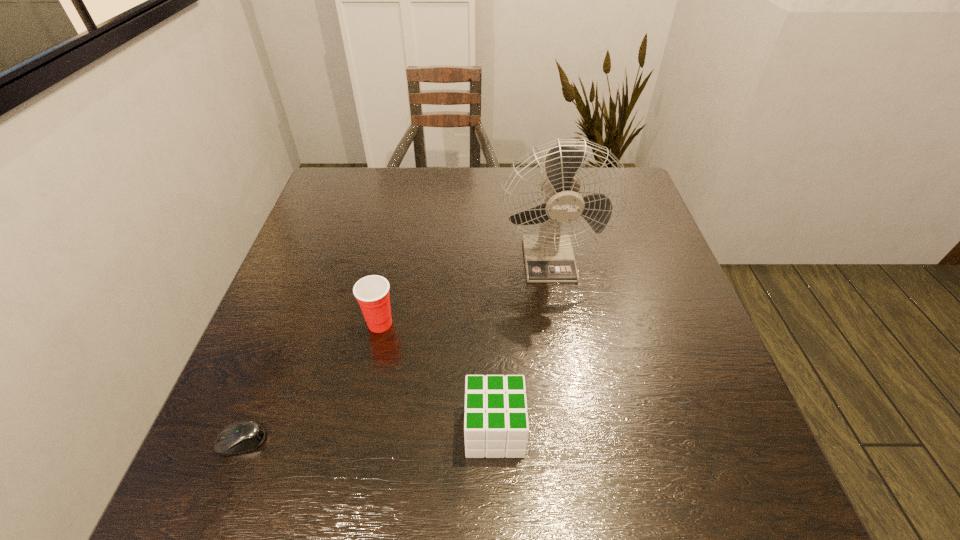
Image resolution: width=960 pixels, height=540 pixels. Find the location of `free space between the third nearest object and the cube`. free space between the third nearest object and the cube is located at coordinates (437, 377).

Locate an element on the screen. The image size is (960, 540). vacant area between the tallest object and the second object from left to right is located at coordinates (465, 291).

I want to click on vacant area that lies between the fan and the cube, so pos(521,344).

The image size is (960, 540). In order to click on empty space that is in between the tallest object and the mouse in this screenshot , I will do `click(396, 349)`.

At what (x,y) coordinates should I click in order to perform the action: click on free space between the tallest object and the second farthest object. Please return your answer as a coordinate pair (x, y). Looking at the image, I should click on (465, 291).

Where is `the closest object to the Dixie cup`? This screenshot has width=960, height=540. the closest object to the Dixie cup is located at coordinates (496, 425).

Identify the location of object that stands as the closest to the leftmost object. This screenshot has width=960, height=540. (372, 292).

The image size is (960, 540). I want to click on vacant area in the image that satisfies the following two spatial constraints: 1. on the air flow direction of the tallest object; 2. on the red face of the cube, so click(x=577, y=430).